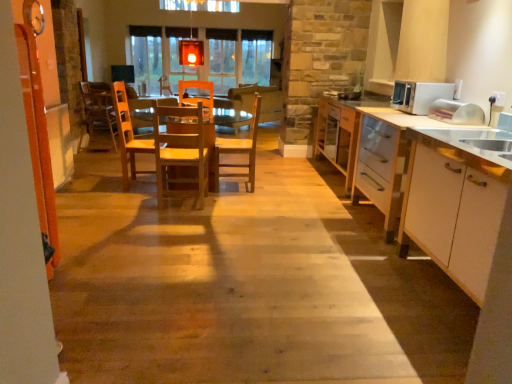
Question: Is wooden floor at center shorter than white glossy cabinet at right?

Choices:
 (A) yes
 (B) no

Answer: (A)

Question: Are wooden floor at center and white glossy cabinet at right located far from each other?

Choices:
 (A) no
 (B) yes

Answer: (B)

Question: Considering the relative positions of wooden floor at center and white glossy cabinet at right in the image provided, is wooden floor at center to the right of white glossy cabinet at right from the viewer's perspective?

Choices:
 (A) no
 (B) yes

Answer: (A)

Question: Is wooden floor at center positioned behind white glossy cabinet at right?

Choices:
 (A) no
 (B) yes

Answer: (B)

Question: From a real-world perspective, is wooden floor at center located beneath white glossy cabinet at right?

Choices:
 (A) no
 (B) yes

Answer: (B)

Question: Considering the relative sizes of wooden floor at center and white glossy cabinet at right in the image provided, is wooden floor at center thinner than white glossy cabinet at right?

Choices:
 (A) no
 (B) yes

Answer: (A)

Question: Can you confirm if wooden chair at center, the first chair in the back-to-front sequence, is taller than wooden chair at center, arranged as the second chair when viewed from the back?

Choices:
 (A) no
 (B) yes

Answer: (A)

Question: From the image's perspective, does wooden chair at center, the 3th chair when ordered from front to back, appear lower than wooden chair at center, which appears as the first chair when viewed from the right?

Choices:
 (A) yes
 (B) no

Answer: (B)

Question: Is wooden chair at center, the first chair in the back-to-front sequence, directly adjacent to wooden chair at center, arranged as the second chair when viewed from the back?

Choices:
 (A) yes
 (B) no

Answer: (B)

Question: Can you confirm if wooden chair at center, which is counted as the third chair, starting from the right, is wider than wooden chair at center, marked as the third chair in a left-to-right arrangement?

Choices:
 (A) no
 (B) yes

Answer: (B)

Question: From a real-world perspective, is wooden chair at center, the 3th chair when ordered from front to back, physically below wooden chair at center, arranged as the second chair when viewed from the back?

Choices:
 (A) yes
 (B) no

Answer: (A)

Question: Is the position of wooden chair at center, the first chair when ordered from left to right, more distant than that of wooden chair at center, acting as the 2th chair starting from the front?

Choices:
 (A) yes
 (B) no

Answer: (A)

Question: Is white glossy cabinet at right not inside translucent glass lantern at upper center?

Choices:
 (A) yes
 (B) no

Answer: (A)